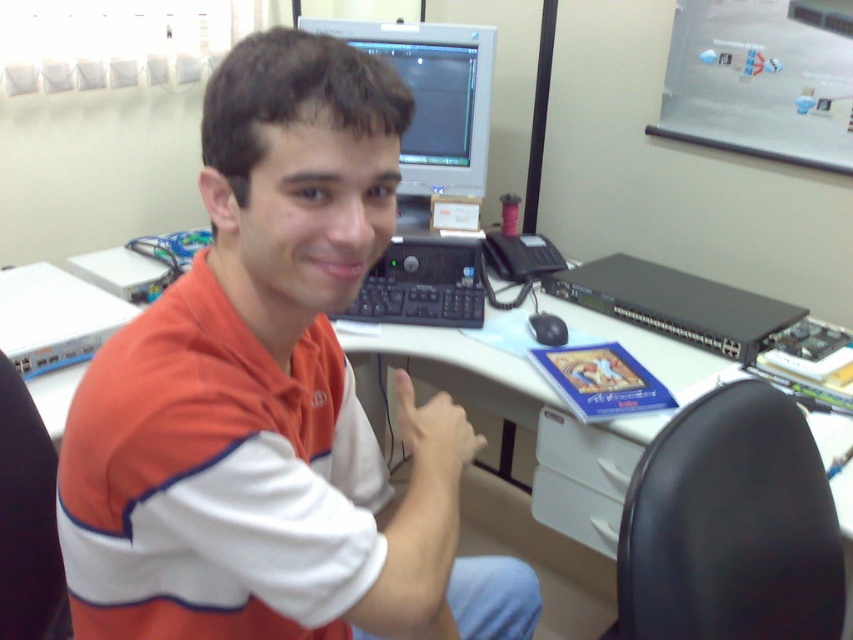
What are the coordinates of the matte black monitor at upper center?

The matte black monitor at upper center is located at point (x=433, y=97).

You are a delivery person who needs to place a small package on the desk between the orange cotton polo shirt at upper left and the black leather swivel chair at lower right. The package requires at least 12 inches of space to be placed safely. Can you fit it there?

The orange cotton polo shirt at upper left is 18.79 inches away from the black leather swivel chair at lower right. Since the required space is 12 inches, the package can be safely placed between them as there is enough space.